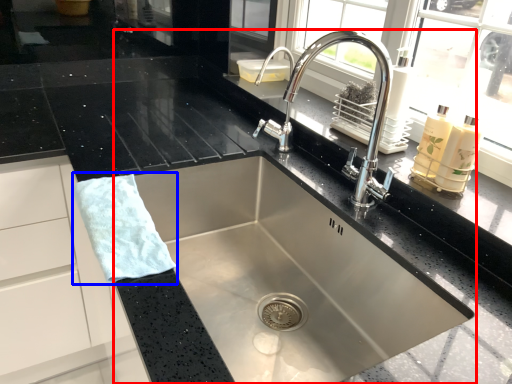
Question: Among these objects, which one is farthest to the camera, sink (highlighted by a red box) or hand towel (highlighted by a blue box)?

Choices:
 (A) sink
 (B) hand towel

Answer: (B)